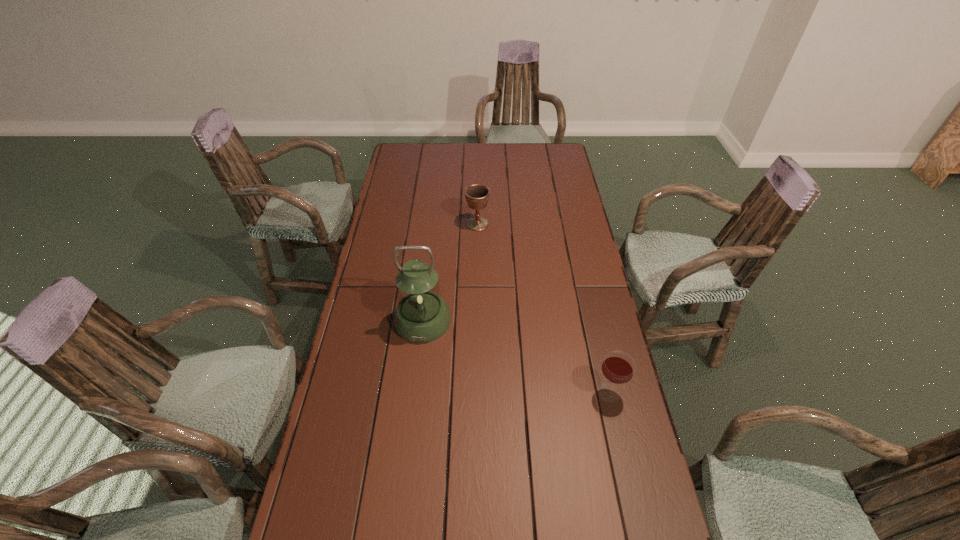
Locate an element on the screen. the leftmost object is located at coordinates (421, 316).

Where is `lantern`? lantern is located at coordinates (421, 316).

Locate an element on the screen. The height and width of the screenshot is (540, 960). the second object from right to left is located at coordinates (477, 195).

Find the location of a particular element. chalice is located at coordinates (477, 195).

Identify the location of wineglass. The image size is (960, 540). (618, 367).

Locate an element on the screen. This screenshot has height=540, width=960. the rightmost object is located at coordinates (618, 367).

Image resolution: width=960 pixels, height=540 pixels. I want to click on vacant area situated on the front of the tallest object, so click(409, 444).

Where is `vacant space located 0.260m on the right of the farthest object`? Image resolution: width=960 pixels, height=540 pixels. vacant space located 0.260m on the right of the farthest object is located at coordinates (552, 224).

Image resolution: width=960 pixels, height=540 pixels. Identify the location of vacant space situated on the back of the nearest object. (588, 301).

The width and height of the screenshot is (960, 540). I want to click on object that is positioned at the left edge, so click(x=421, y=316).